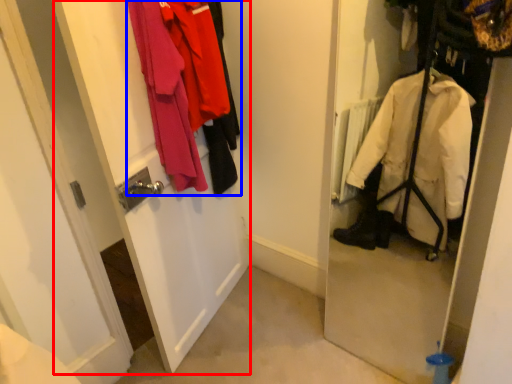
Question: Which object appears farthest to the camera in this image, screen door (highlighted by a red box) or laundry (highlighted by a blue box)?

Choices:
 (A) screen door
 (B) laundry

Answer: (B)